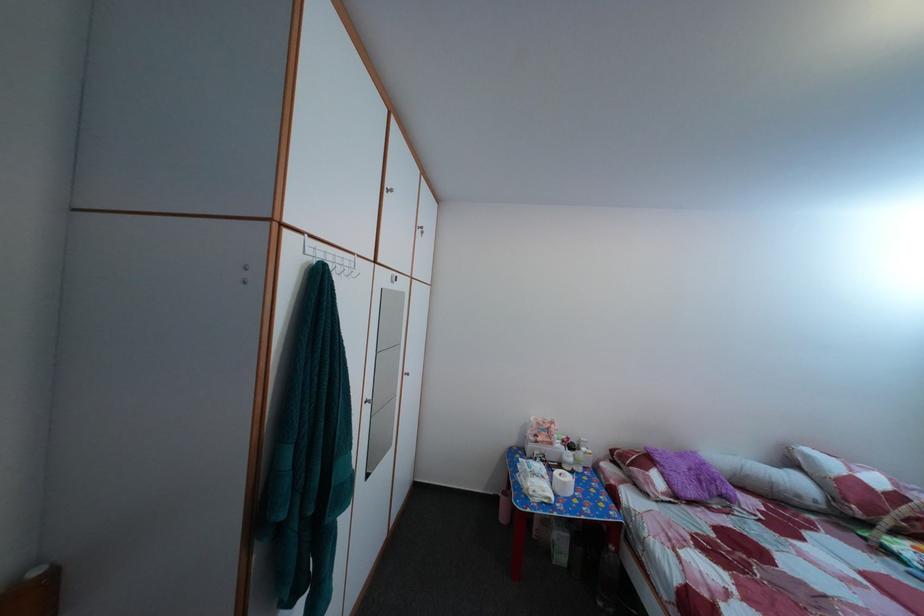
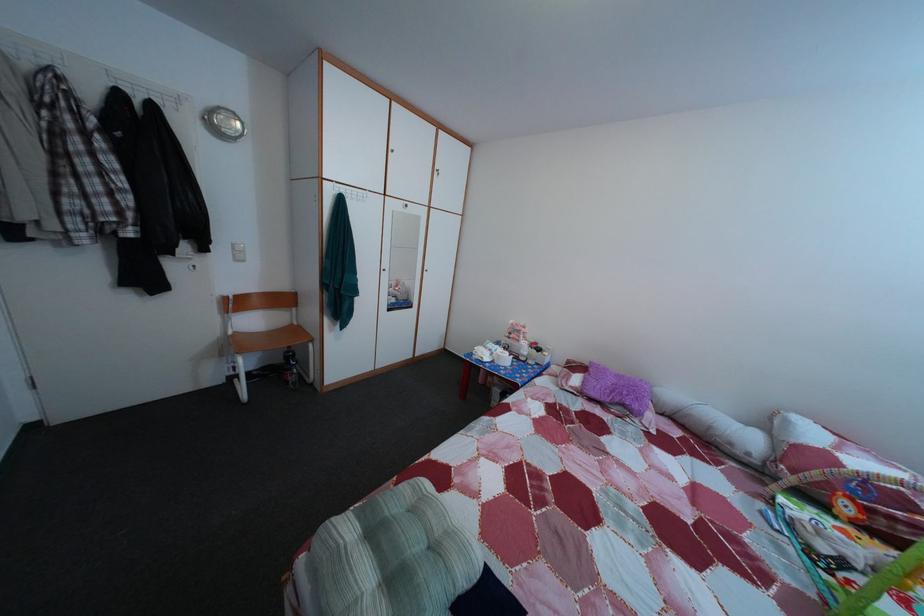
In the second image, find the point that corresponds to point (561, 452) in the first image.

(528, 349)